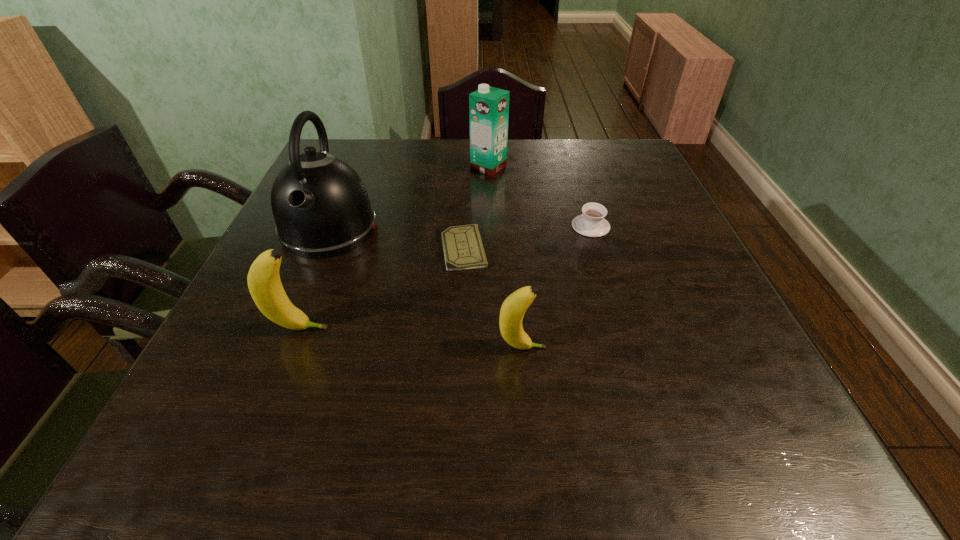
Where is `the second nearest object`? the second nearest object is located at coordinates (264, 283).

Image resolution: width=960 pixels, height=540 pixels. Identify the location of the left banana. (264, 283).

The image size is (960, 540). What are the coordinates of `the third shortest object` in the screenshot? It's located at (512, 311).

At what (x,y) coordinates should I click in order to perform the action: click on the nearer banana. Please return your answer as a coordinate pair (x, y). Looking at the image, I should click on (512, 311).

At what (x,y) coordinates should I click in order to perform the action: click on the second tallest object. Please return your answer as a coordinate pair (x, y). The image size is (960, 540). Looking at the image, I should click on (488, 107).

Find the location of a particular element. This screenshot has width=960, height=540. the farthest object is located at coordinates (488, 107).

At what (x,y) coordinates should I click in order to perform the action: click on teacup. Please return your answer as a coordinate pair (x, y). Image resolution: width=960 pixels, height=540 pixels. Looking at the image, I should click on (591, 223).

Find the location of a particular element. The image size is (960, 540). the fifth tallest object is located at coordinates (591, 223).

What are the coordinates of `kettle` in the screenshot? It's located at (321, 208).

Identify the location of checkbook. (462, 245).